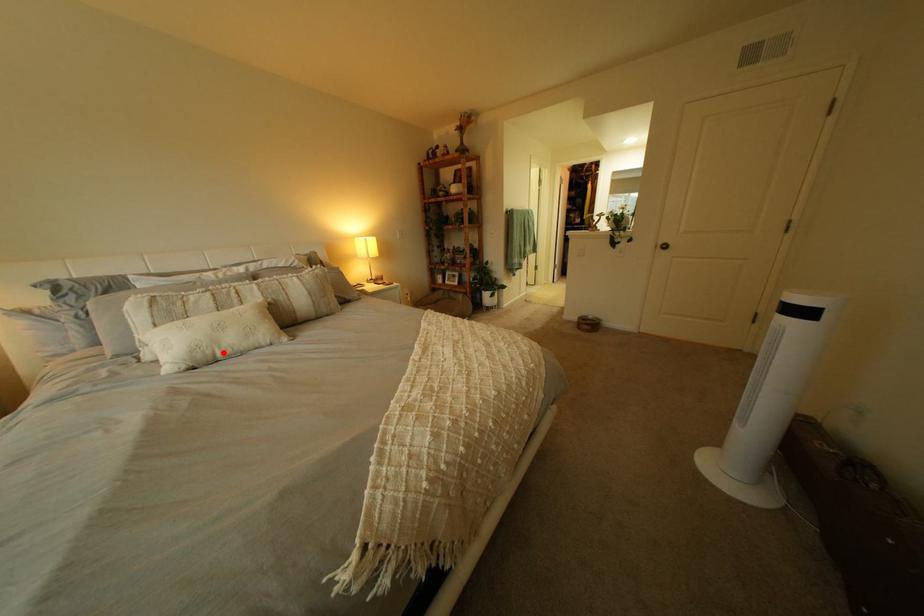
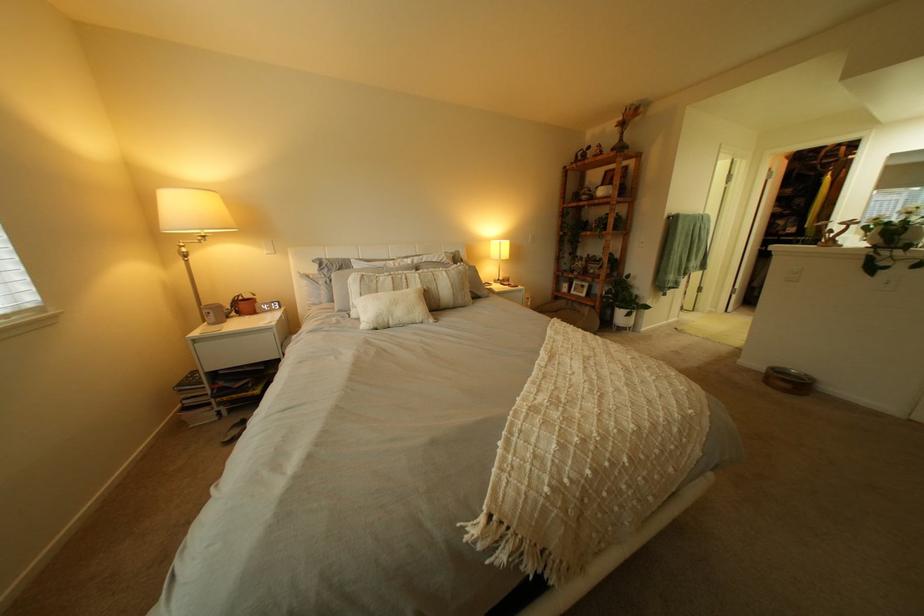
Where in the second image is the point corresponding to the highlighted location from the first image?

(400, 320)